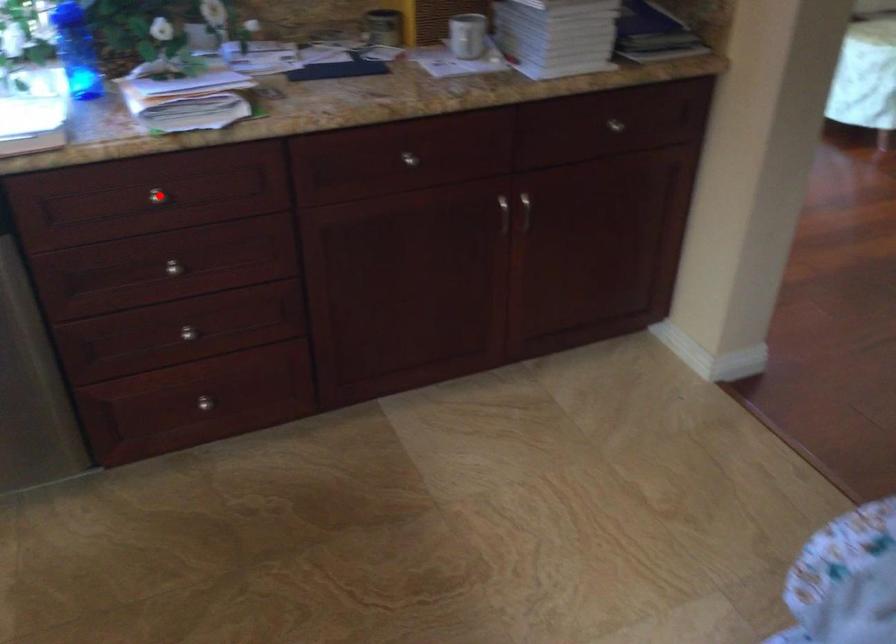
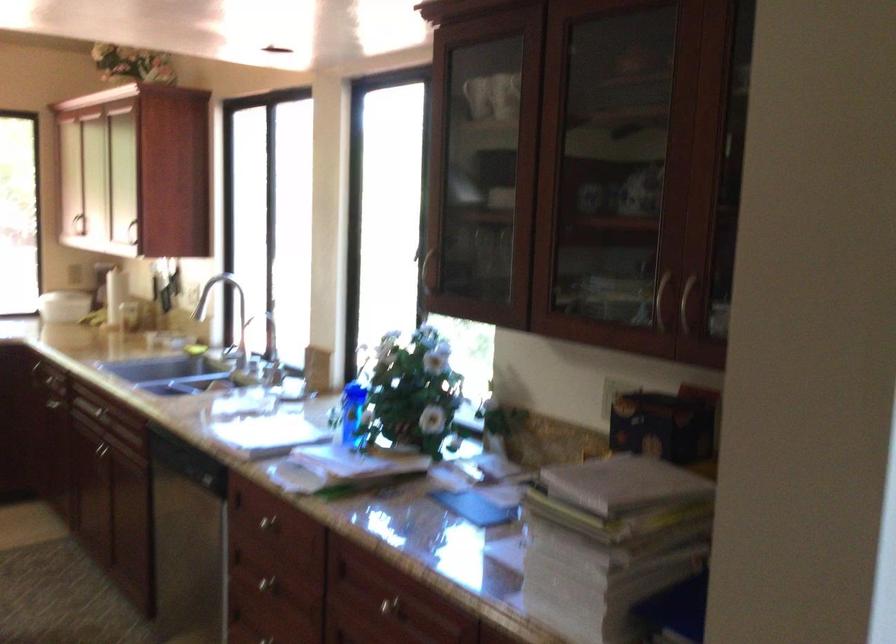
Locate, in the second image, the point that corresponds to the highlighted location in the first image.

(266, 522)